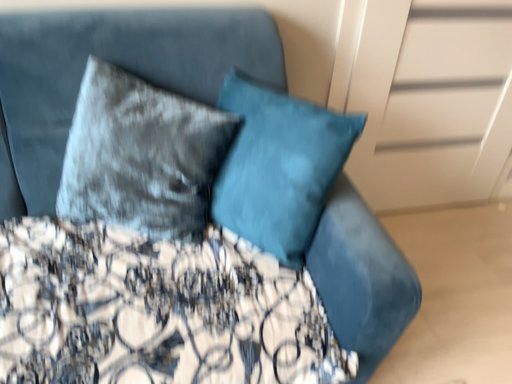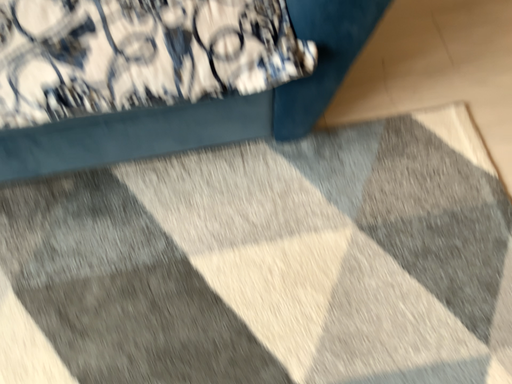
Question: How did the camera likely rotate when shooting the video?

Choices:
 (A) rotated upward
 (B) rotated downward

Answer: (B)